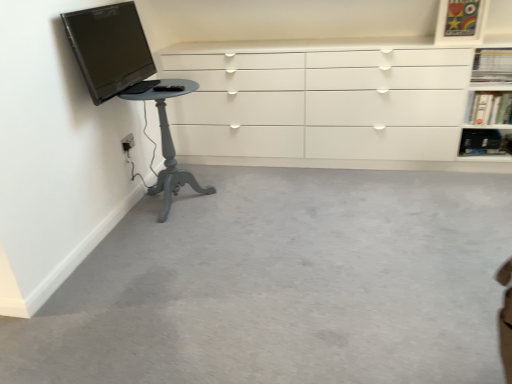
Question: From a real-world perspective, is white plastic electric outlet at lower left on top of black plastic shelf at upper right, the first shelf positioned from the bottom?

Choices:
 (A) no
 (B) yes

Answer: (B)

Question: Can you confirm if white plastic electric outlet at lower left is thinner than black plastic shelf at upper right, placed as the third shelf when sorted from top to bottom?

Choices:
 (A) no
 (B) yes

Answer: (B)

Question: Is white plastic electric outlet at lower left not inside black plastic shelf at upper right, the first shelf positioned from the bottom?

Choices:
 (A) no
 (B) yes

Answer: (B)

Question: Is black plastic shelf at upper right, placed as the third shelf when sorted from top to bottom, a part of white plastic electric outlet at lower left?

Choices:
 (A) no
 (B) yes

Answer: (A)

Question: Can you confirm if white plastic electric outlet at lower left is positioned to the left of black plastic shelf at upper right, the first shelf positioned from the bottom?

Choices:
 (A) yes
 (B) no

Answer: (A)

Question: Does point (492, 69) appear closer or farther from the camera than point (487, 147)?

Choices:
 (A) farther
 (B) closer

Answer: (B)

Question: From a real-world perspective, relative to black plastic shelf at upper right, placed as the third shelf when sorted from top to bottom, is white glossy bookshelf at upper right, the 1th shelf viewed from the top, vertically above or below?

Choices:
 (A) above
 (B) below

Answer: (A)

Question: Considering the positions of white glossy bookshelf at upper right, acting as the 3th shelf starting from the bottom, and black plastic shelf at upper right, placed as the third shelf when sorted from top to bottom, in the image, is white glossy bookshelf at upper right, acting as the 3th shelf starting from the bottom, taller or shorter than black plastic shelf at upper right, placed as the third shelf when sorted from top to bottom,?

Choices:
 (A) short
 (B) tall

Answer: (B)

Question: Is white glossy bookshelf at upper right, acting as the 3th shelf starting from the bottom, wider or thinner than black plastic shelf at upper right, the first shelf positioned from the bottom?

Choices:
 (A) wide
 (B) thin

Answer: (A)

Question: From a real-world perspective, is white glossy chest of drawers at upper center above or below white glossy bookshelf at upper right, the 2th shelf positioned from the bottom?

Choices:
 (A) below
 (B) above

Answer: (A)

Question: Is point (297, 110) positioned closer to the camera than point (479, 112)?

Choices:
 (A) farther
 (B) closer

Answer: (A)

Question: Is white glossy chest of drawers at upper center inside the boundaries of white glossy bookshelf at upper right, which is counted as the second shelf, starting from the top, or outside?

Choices:
 (A) outside
 (B) inside

Answer: (A)

Question: Is white glossy chest of drawers at upper center bigger or smaller than white glossy bookshelf at upper right, the 2th shelf positioned from the bottom?

Choices:
 (A) big
 (B) small

Answer: (A)

Question: Considering the relative positions of black plastic shelf at upper right, the first shelf positioned from the bottom, and matte gray pedestal table at left in the image provided, is black plastic shelf at upper right, the first shelf positioned from the bottom, to the left or to the right of matte gray pedestal table at left?

Choices:
 (A) left
 (B) right

Answer: (B)

Question: Considering the positions of point (476, 137) and point (170, 165), is point (476, 137) closer or farther from the camera than point (170, 165)?

Choices:
 (A) closer
 (B) farther

Answer: (B)